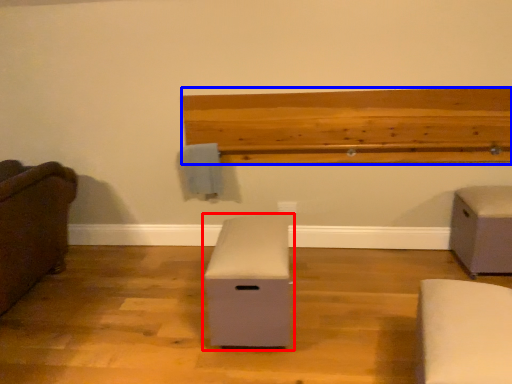
Question: Which of the following is the farthest to the observer, furniture (highlighted by a red box) or ledge (highlighted by a blue box)?

Choices:
 (A) furniture
 (B) ledge

Answer: (B)